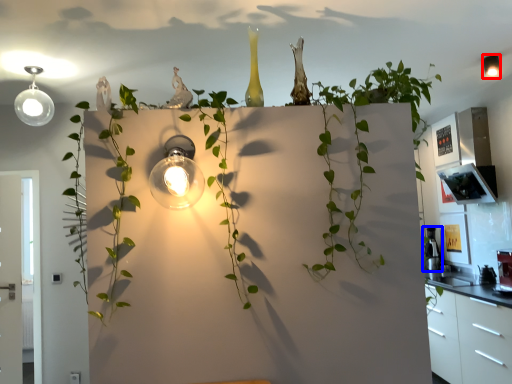
Question: Which object appears farthest to the camera in this image, light fixture (highlighted by a red box) or appliance (highlighted by a blue box)?

Choices:
 (A) light fixture
 (B) appliance

Answer: (B)